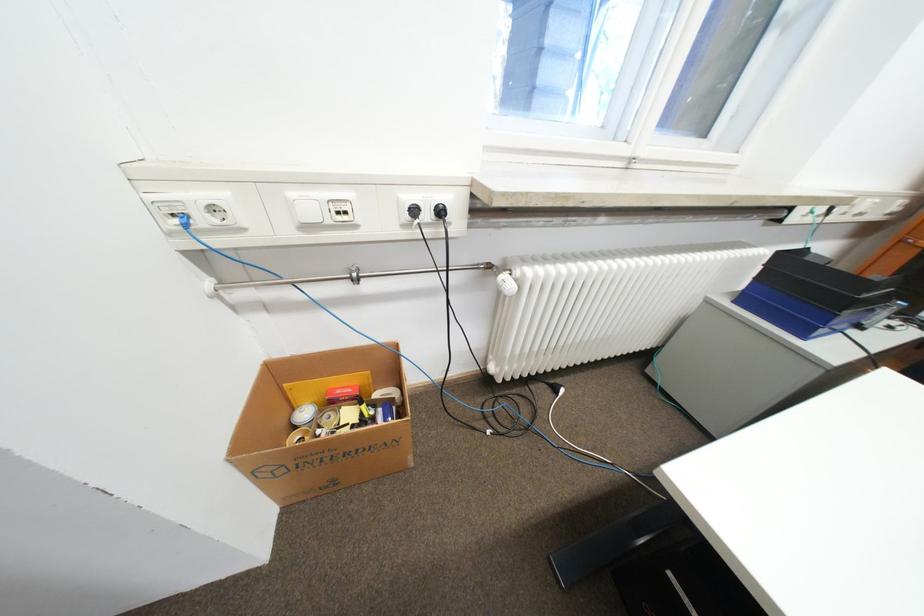
What do you see at coordinates (505, 282) in the screenshot? I see `the radiator control knob` at bounding box center [505, 282].